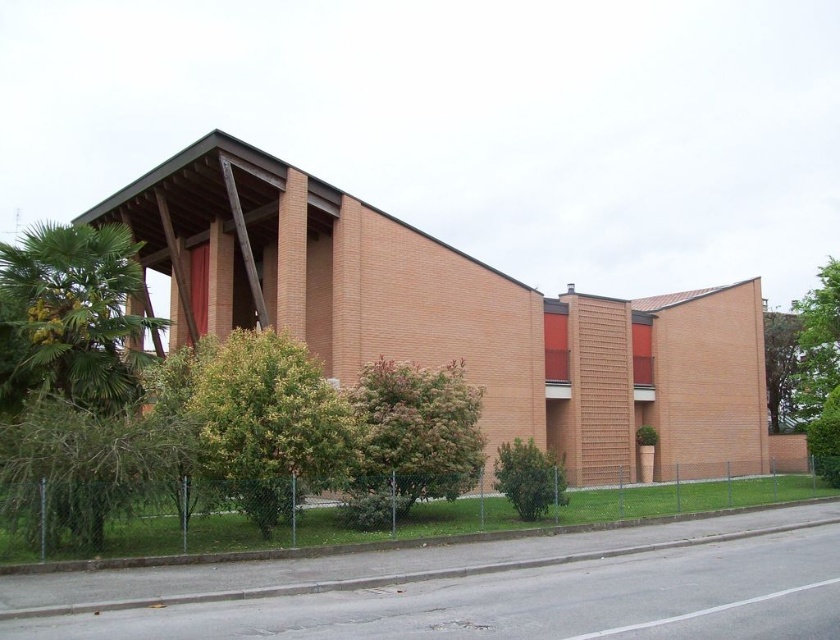
Question: Estimate the real-world distances between objects in this image. Which object is farther from the green leafy tree at left?

Choices:
 (A) green leafy bush at lower center
 (B) green leafy tree at lower left
 (C) green leafy tree at upper right
 (D) green leafy tree at center

Answer: (C)

Question: Which object is farther from the camera taking this photo?

Choices:
 (A) green leafy tree at lower left
 (B) green leafy tree at upper right
 (C) green leafy tree at center

Answer: (B)

Question: Is green leafy tree at lower left closer to camera compared to green leafy tree at center?

Choices:
 (A) no
 (B) yes

Answer: (B)

Question: Is green leafy tree at lower left wider than green leafy tree at upper right?

Choices:
 (A) yes
 (B) no

Answer: (B)

Question: Which of these objects is positioned farthest from the green leafy tree at center?

Choices:
 (A) green leafy bush at lower center
 (B) green leafy tree at lower left
 (C) green leafy tree at upper right
 (D) green leafy tree at left

Answer: (C)

Question: Is green leafy tree at lower left further to camera compared to green leafy bush at lower center?

Choices:
 (A) no
 (B) yes

Answer: (A)